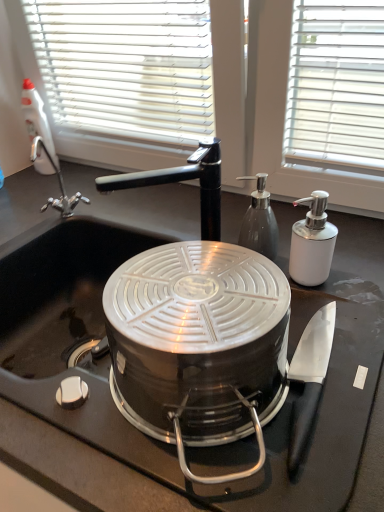
What are the coordinates of `free space in front of white plastic spray bottle at upper left` in the screenshot? It's located at (39, 187).